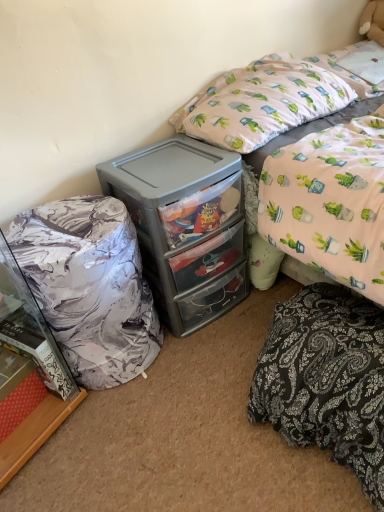
Where is `free spot in front of gray plastic chest of drawers at center`? free spot in front of gray plastic chest of drawers at center is located at coordinates (202, 370).